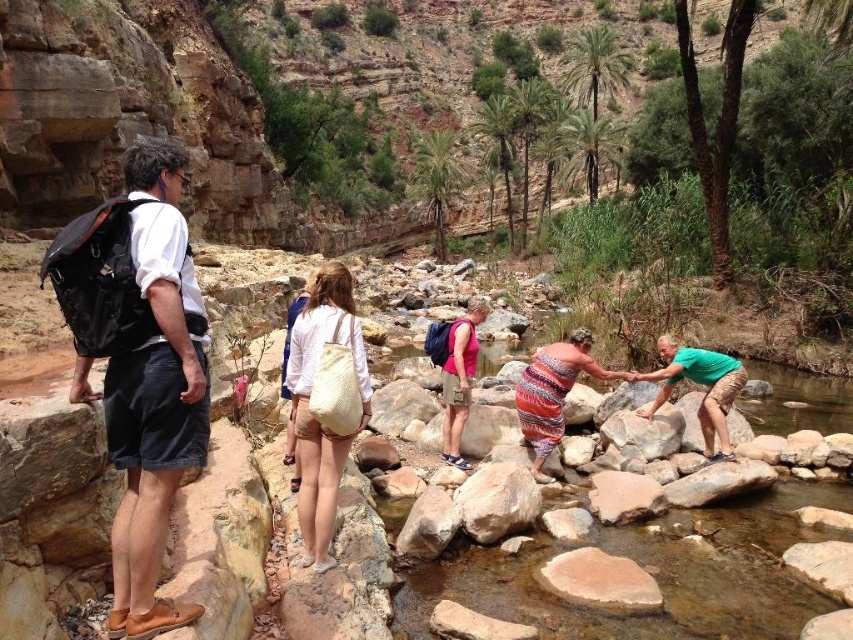
Question: Which point appears closest to the camera in this image?

Choices:
 (A) (149, 472)
 (B) (666, 349)

Answer: (A)

Question: Is black fabric backpack at left below green fabric shorts at center-right?

Choices:
 (A) no
 (B) yes

Answer: (A)

Question: Is black fabric backpack at left smaller than green fabric shorts at center-right?

Choices:
 (A) no
 (B) yes

Answer: (A)

Question: Which point appears closest to the camera in this image?

Choices:
 (A) (171, 172)
 (B) (645, 376)

Answer: (A)

Question: Can you confirm if black fabric backpack at left is wider than green fabric shorts at center-right?

Choices:
 (A) yes
 (B) no

Answer: (A)